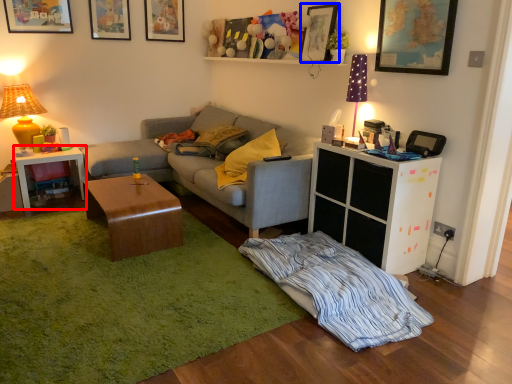
Question: Which object is closer to the camera taking this photo, table (highlighted by a red box) or picture frame (highlighted by a blue box)?

Choices:
 (A) table
 (B) picture frame

Answer: (B)